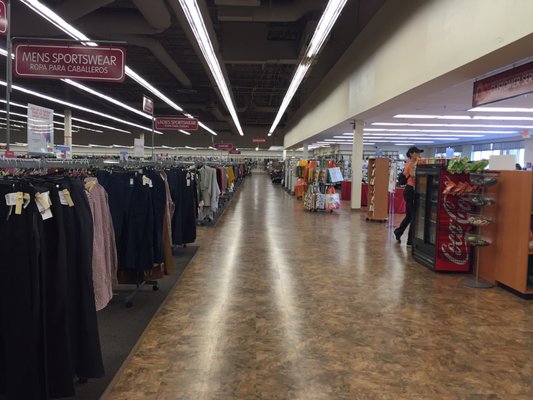
Find the location of `clothes rack`. clothes rack is located at coordinates (77, 256), (100, 241), (129, 218), (192, 202), (205, 189), (225, 174), (233, 170), (242, 166), (252, 164).